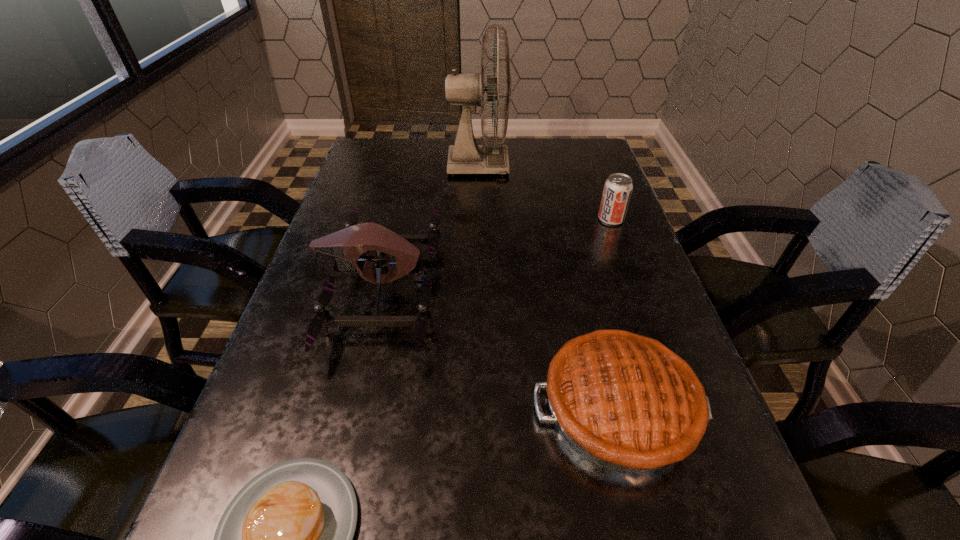
At what (x,y) coordinates should I click in order to perform the action: click on blank space that satisfies the following two spatial constraints: 1. on the back side of the pie; 2. on the front-facing side of the drone. Please return your answer as a coordinate pair (x, y). This screenshot has height=540, width=960. Looking at the image, I should click on (588, 289).

Image resolution: width=960 pixels, height=540 pixels. Identify the location of vacant space that satisfies the following two spatial constraints: 1. on the front-facing side of the tallest object; 2. on the right side of the pie. (477, 408).